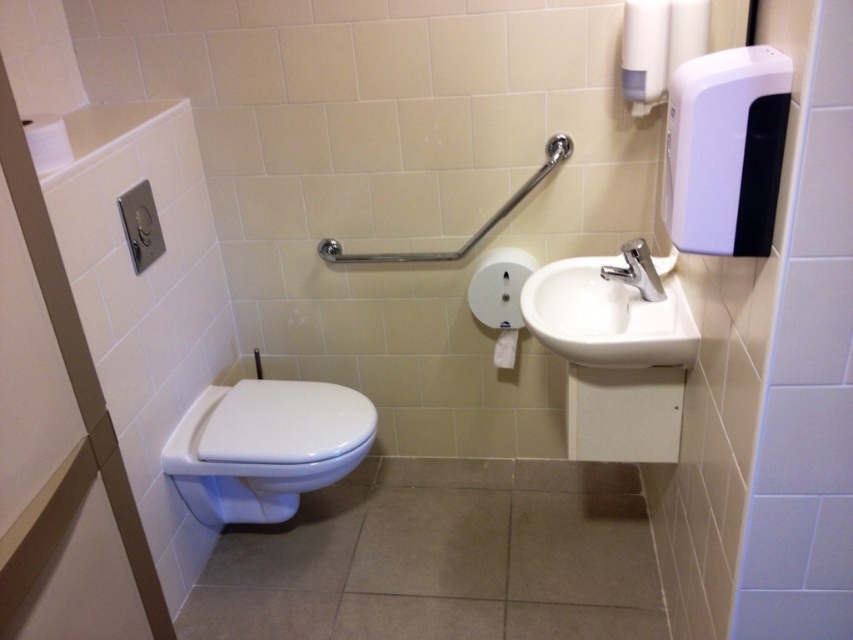
Question: Estimate the real-world distances between objects in this image. Which object is farther from the white glossy sink at right?

Choices:
 (A) white glossy bidet at lower left
 (B) white matte toilet paper at center

Answer: (A)

Question: Is white glossy bidet at lower left to the right of silver metallic faucet at upper right from the viewer's perspective?

Choices:
 (A) no
 (B) yes

Answer: (A)

Question: Which of the following is the farthest from the observer?

Choices:
 (A) (231, 433)
 (B) (497, 346)
 (C) (38, 138)
 (D) (619, 269)

Answer: (B)

Question: Which point is farther to the camera?

Choices:
 (A) white matte toilet paper at center
 (B) white glossy bidet at lower left
 (C) white glossy sink at right

Answer: (A)

Question: Can you confirm if silver metallic faucet at upper right is positioned to the left of white matte toilet paper at center?

Choices:
 (A) no
 (B) yes

Answer: (A)

Question: Can you confirm if white matte toilet paper at upper left is positioned to the right of white matte toilet paper at center?

Choices:
 (A) yes
 (B) no

Answer: (B)